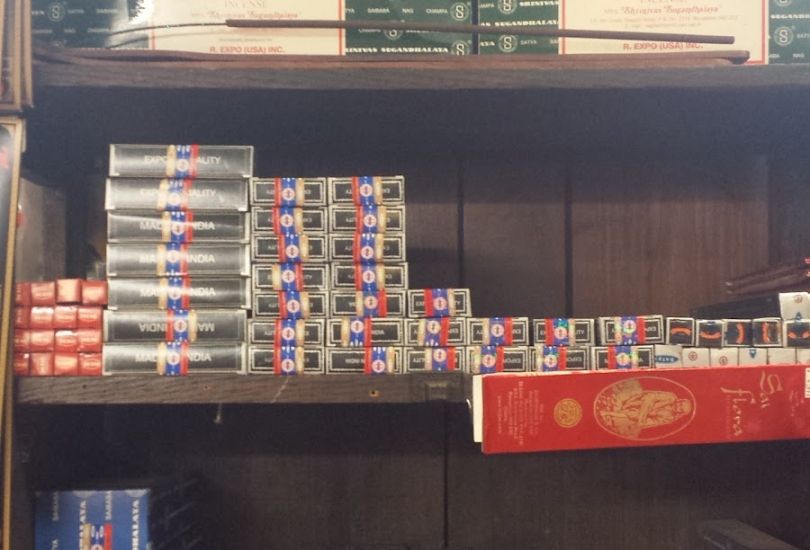
At what (x,y) coordinates should I click in order to perform the action: click on bookcase. Please return your answer as a coordinate pair (x, y). The width and height of the screenshot is (810, 550). Looking at the image, I should click on (522, 227), (357, 458).